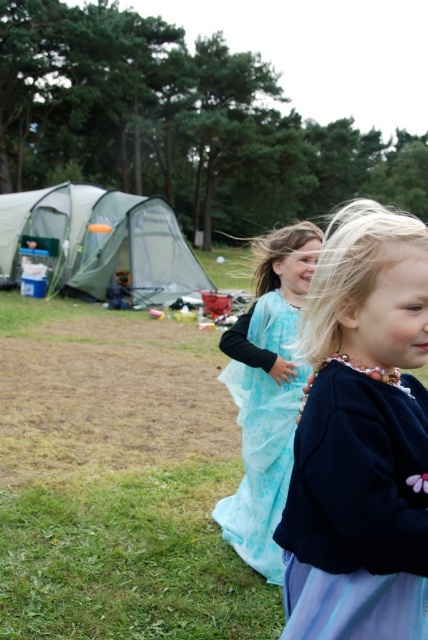
You are planning to set up a small garden in the campsite area. The green grass at lower left and the green fabric tent at left are already present. Which area would be better for planting flowers, and why?

The green grass at lower left is thinner than the green fabric tent at left, so the area with the green grass at lower left would be better for planting flowers since thinner grass indicates less competition for nutrients and space.